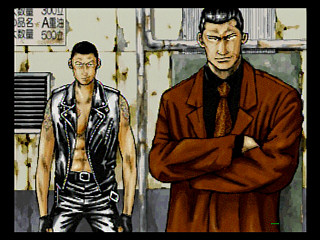
Where is `wall`? wall is located at coordinates (130, 69).